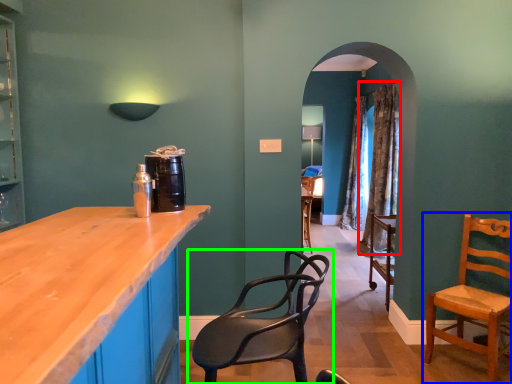
Question: Which object is positioned farthest from curtain (highlighted by a red box)? Select from chair (highlighted by a blue box) and chair (highlighted by a green box).

Choices:
 (A) chair
 (B) chair

Answer: (B)